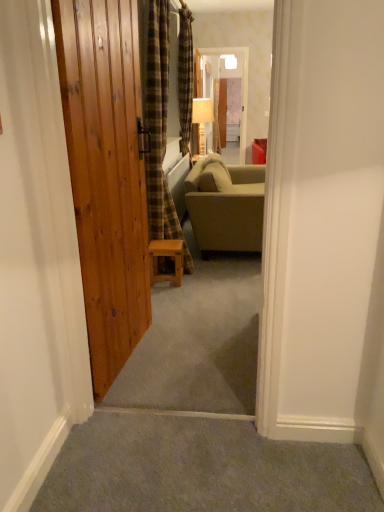
This screenshot has height=512, width=384. What do you see at coordinates (106, 174) in the screenshot?
I see `natural wood door at left` at bounding box center [106, 174].

Measure the distance between plaid fabric curtain at center, the first curtain viewed from the back, and camera.

plaid fabric curtain at center, the first curtain viewed from the back, and camera are 3.35 meters apart from each other.

Locate an element on the screen. This screenshot has width=384, height=512. wooden textured lamp at center is located at coordinates (202, 120).

Where is `matte beige couch at center`? This screenshot has width=384, height=512. matte beige couch at center is located at coordinates (226, 205).

Locate an element on the screen. The image size is (384, 512). natural wood door at left is located at coordinates (106, 174).

Which of these two, plaid fabric curtain at center, the second curtain viewed from the front, or wooden textured lamp at center, is thinner?

plaid fabric curtain at center, the second curtain viewed from the front, is thinner.

Is plaid fabric curtain at center, the first curtain viewed from the back, in contact with wooden textured lamp at center?

There is a gap between plaid fabric curtain at center, the first curtain viewed from the back, and wooden textured lamp at center.

How different are the orientations of plaid fabric curtain at center, the first curtain viewed from the back, and wooden textured lamp at center in degrees?

The facing directions of plaid fabric curtain at center, the first curtain viewed from the back, and wooden textured lamp at center are 3.86 degrees apart.

Can you confirm if plaid fabric curtain at center, the second curtain viewed from the front, is positioned to the right of wooden textured lamp at center?

In fact, plaid fabric curtain at center, the second curtain viewed from the front, is to the left of wooden textured lamp at center.

Is wooden textured lamp at center in front of plaid fabric curtain at center, which is the 1th curtain in front-to-back order?

No.

Which of these two, wooden textured lamp at center or plaid fabric curtain at center, which is the 1th curtain in front-to-back order, stands shorter?

wooden textured lamp at center.

From the image's perspective, which one is positioned lower, wooden textured lamp at center or plaid fabric curtain at center, which is the second curtain from back to front?

From the image's view, plaid fabric curtain at center, which is the second curtain from back to front, is below.

Does point (195, 112) appear closer or farther from the camera than point (165, 22)?

Point (195, 112) is positioned farther from the camera compared to point (165, 22).

From the image's perspective, is wooden textured lamp at center above or below natural wood door at left?

From the image's perspective, wooden textured lamp at center appears above natural wood door at left.

Can you confirm if wooden textured lamp at center is thinner than natural wood door at left?

No.

How many degrees apart are the facing directions of wooden textured lamp at center and natural wood door at left?

wooden textured lamp at center and natural wood door at left are facing 8.64 degrees away from each other.

Would you consider wooden textured lamp at center to be distant from natural wood door at left?

Indeed, wooden textured lamp at center is not near natural wood door at left.

Could you tell me if plaid fabric curtain at center, which is the 1th curtain in front-to-back order, is facing natural wood door at left?

No.

Between plaid fabric curtain at center, which is the second curtain from back to front, and natural wood door at left, which one appears on the right side from the viewer's perspective?

From the viewer's perspective, plaid fabric curtain at center, which is the second curtain from back to front, appears more on the right side.

Are plaid fabric curtain at center, which is the second curtain from back to front, and natural wood door at left far apart?

They are positioned close to each other.

Considering the relative sizes of plaid fabric curtain at center, which is the second curtain from back to front, and natural wood door at left in the image provided, is plaid fabric curtain at center, which is the second curtain from back to front, shorter than natural wood door at left?

No, plaid fabric curtain at center, which is the second curtain from back to front, is not shorter than natural wood door at left.

Who is shorter, matte beige couch at center or wooden textured lamp at center?

wooden textured lamp at center is shorter.

From the image's perspective, is matte beige couch at center above wooden textured lamp at center?

Actually, matte beige couch at center appears below wooden textured lamp at center in the image.

Is matte beige couch at center positioned before wooden textured lamp at center?

Yes, matte beige couch at center is closer to the viewer.

Is matte beige couch at center turned away from wooden textured lamp at center?

No, matte beige couch at center's orientation is not away from wooden textured lamp at center.

Can you confirm if translucent plastic screen door at center is wider than plaid fabric curtain at center, which is the 1th curtain in front-to-back order?

No, translucent plastic screen door at center is not wider than plaid fabric curtain at center, which is the 1th curtain in front-to-back order.

Considering the positions of objects translucent plastic screen door at center and plaid fabric curtain at center, which is the second curtain from back to front, in the image provided, who is more to the left, translucent plastic screen door at center or plaid fabric curtain at center, which is the second curtain from back to front,?

plaid fabric curtain at center, which is the second curtain from back to front.

From their relative heights in the image, would you say translucent plastic screen door at center is taller or shorter than plaid fabric curtain at center, which is the second curtain from back to front?

In the image, translucent plastic screen door at center appears to be shorter than plaid fabric curtain at center, which is the second curtain from back to front.

Is natural wood door at left oriented towards wooden textured lamp at center?

No, natural wood door at left is not turned towards wooden textured lamp at center.

Can you confirm if natural wood door at left is thinner than wooden textured lamp at center?

Yes, natural wood door at left is thinner than wooden textured lamp at center.

Is natural wood door at left in front of or behind wooden textured lamp at center in the image?

Visually, natural wood door at left is located in front of wooden textured lamp at center.

Does point (102, 356) come farther from viewer compared to point (202, 139)?

No, (102, 356) is closer to viewer.

The width and height of the screenshot is (384, 512). I want to click on lamp lying on the right of plaid fabric curtain at center, the second curtain viewed from the front, so click(x=202, y=120).

Locate an element on the screen. Image resolution: width=384 pixels, height=512 pixels. curtain that is under the wooden textured lamp at center (from a real-world perspective) is located at coordinates (158, 121).

Considering their positions, is wooden stool at center positioned further to matte beige couch at center than translucent plastic screen door at center?

translucent plastic screen door at center lies further to matte beige couch at center than the other object.

Based on their spatial positions, is wooden stool at center or matte beige couch at center closer to plaid fabric curtain at center, the first curtain viewed from the back?

Among the two, matte beige couch at center is located nearer to plaid fabric curtain at center, the first curtain viewed from the back.

Considering their positions, is plaid fabric curtain at center, the second curtain viewed from the front, positioned closer to wooden stool at center than translucent plastic screen door at center?

plaid fabric curtain at center, the second curtain viewed from the front.

Consider the image. Which object lies nearer to the anchor point plaid fabric curtain at center, which is the second curtain from back to front, translucent plastic screen door at center or wooden textured lamp at center?

wooden textured lamp at center lies closer to plaid fabric curtain at center, which is the second curtain from back to front, than the other object.

Looking at the image, which one is located closer to wooden stool at center, plaid fabric curtain at center, which is the second curtain from back to front, or translucent plastic screen door at center?

plaid fabric curtain at center, which is the second curtain from back to front.

When comparing their distances from plaid fabric curtain at center, the first curtain viewed from the back, does wooden stool at center or natural wood door at left seem further?

natural wood door at left.

From the picture: Based on their spatial positions, is plaid fabric curtain at center, the second curtain viewed from the front, or translucent plastic screen door at center further from wooden textured lamp at center?

plaid fabric curtain at center, the second curtain viewed from the front, lies further to wooden textured lamp at center than the other object.

Which object lies further to the anchor point wooden stool at center, plaid fabric curtain at center, the first curtain viewed from the back, or plaid fabric curtain at center, which is the second curtain from back to front?

The object further to wooden stool at center is plaid fabric curtain at center, the first curtain viewed from the back.

What are the coordinates of `studio couch between plaid fabric curtain at center, which is the 1th curtain in front-to-back order, and translucent plastic screen door at center, along the z-axis` in the screenshot? It's located at (226, 205).

In order to click on lamp between plaid fabric curtain at center, which is the 1th curtain in front-to-back order, and translucent plastic screen door at center in the front-back direction in this screenshot , I will do `click(202, 120)`.

Where is `curtain positioned between natural wood door at left and wooden stool at center from near to far`? This screenshot has width=384, height=512. curtain positioned between natural wood door at left and wooden stool at center from near to far is located at coordinates 158,121.

I want to click on lamp between natural wood door at left and translucent plastic screen door at center along the z-axis, so click(x=202, y=120).